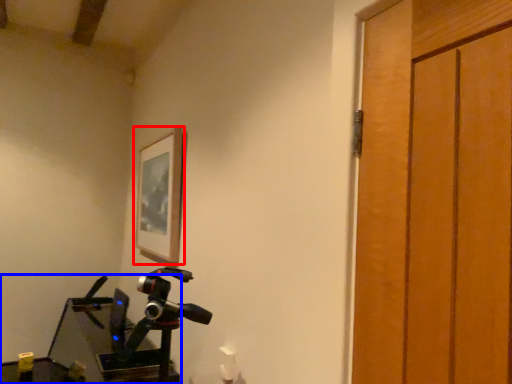
Question: Among these objects, which one is nearest to the camera, picture frame (highlighted by a red box) or workbench (highlighted by a blue box)?

Choices:
 (A) picture frame
 (B) workbench

Answer: (B)